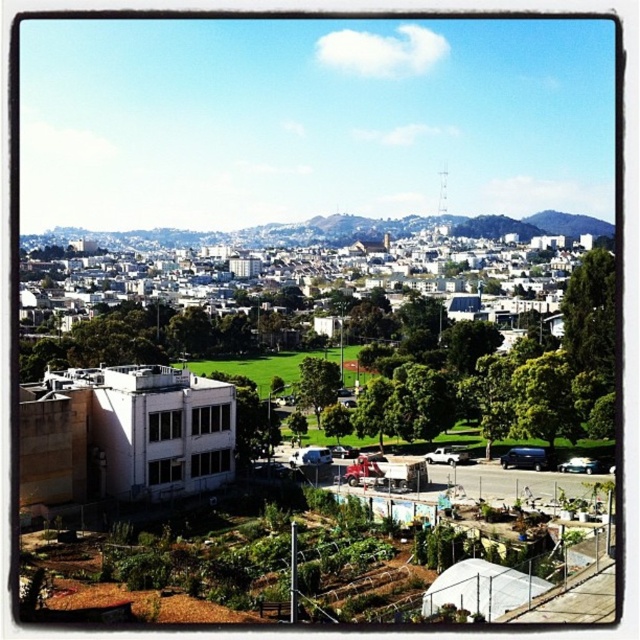
Question: Is green grassy hillside at center to the right of green leafy tree at center from the viewer's perspective?

Choices:
 (A) no
 (B) yes

Answer: (A)

Question: Does green grassy hillside at center appear under green leafy tree at right?

Choices:
 (A) no
 (B) yes

Answer: (A)

Question: Does green grassy hillside at center have a greater width compared to green leafy tree at right?

Choices:
 (A) no
 (B) yes

Answer: (B)

Question: Which of the following is the closest to the observer?

Choices:
 (A) (586, 346)
 (B) (330, 364)

Answer: (A)

Question: Which of these objects is positioned farthest from the green leafy tree at center?

Choices:
 (A) green grassy hillside at center
 (B) green leafy tree at right

Answer: (A)

Question: Which point is farther to the camera?

Choices:
 (A) green leafy tree at center
 (B) green leafy tree at right

Answer: (A)